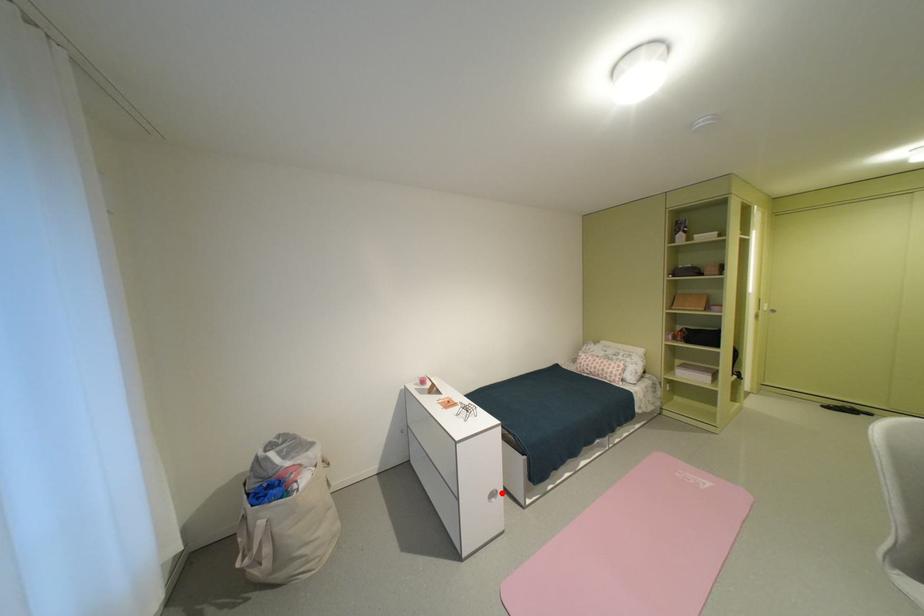
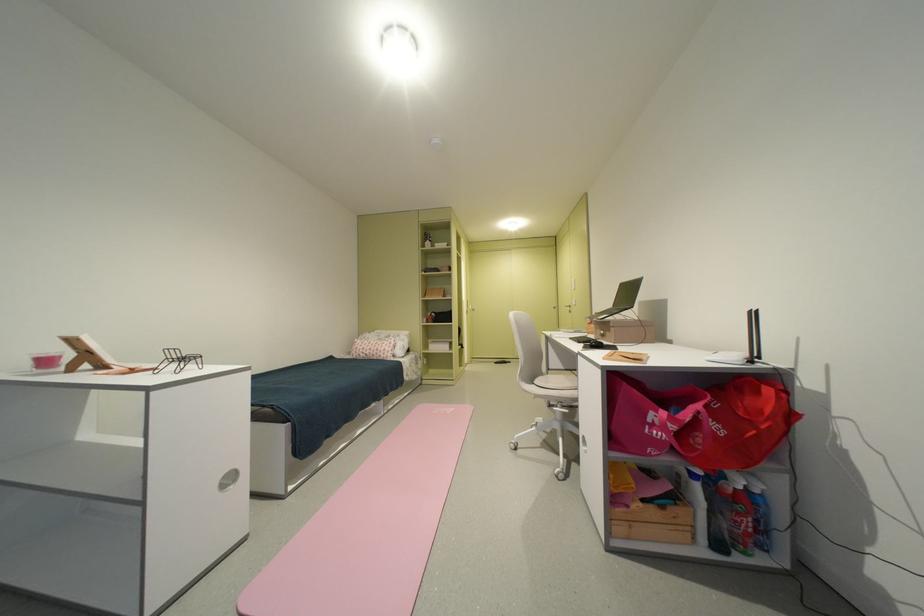
In the second image, find the point that corresponds to the highlighted location in the first image.

(237, 477)